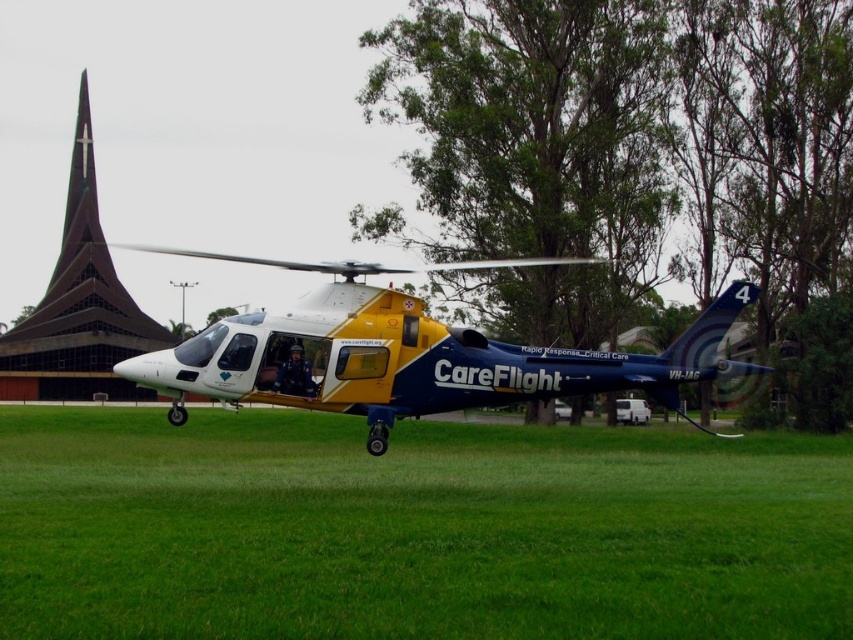
Can you confirm if green grass at lower center is taller than dark brown glass spire at upper left?

No, green grass at lower center is not taller than dark brown glass spire at upper left.

Where is `green grass at lower center`? green grass at lower center is located at coordinates (x=415, y=531).

Is point (554, 458) behind point (386, 336)?

Yes, point (554, 458) is behind point (386, 336).

Between green grass at lower center and yellow matte careflight helicopter at center, which one has more height?

With more height is yellow matte careflight helicopter at center.

Based on the photo, measure the distance between green grass at lower center and camera.

They are 5.25 meters apart.

At what (x,y) coordinates should I click in order to perform the action: click on green grass at lower center. Please return your answer as a coordinate pair (x, y). The image size is (853, 640). Looking at the image, I should click on (415, 531).

Is the position of yellow matte careflight helicopter at center less distant than that of dark brown glass spire at upper left?

Yes.

Between yellow matte careflight helicopter at center and dark brown glass spire at upper left, which one appears on the left side from the viewer's perspective?

dark brown glass spire at upper left is more to the left.

Does point (355, 336) lie in front of point (99, 337)?

Yes, it is in front of point (99, 337).

The height and width of the screenshot is (640, 853). I want to click on yellow matte careflight helicopter at center, so click(410, 356).